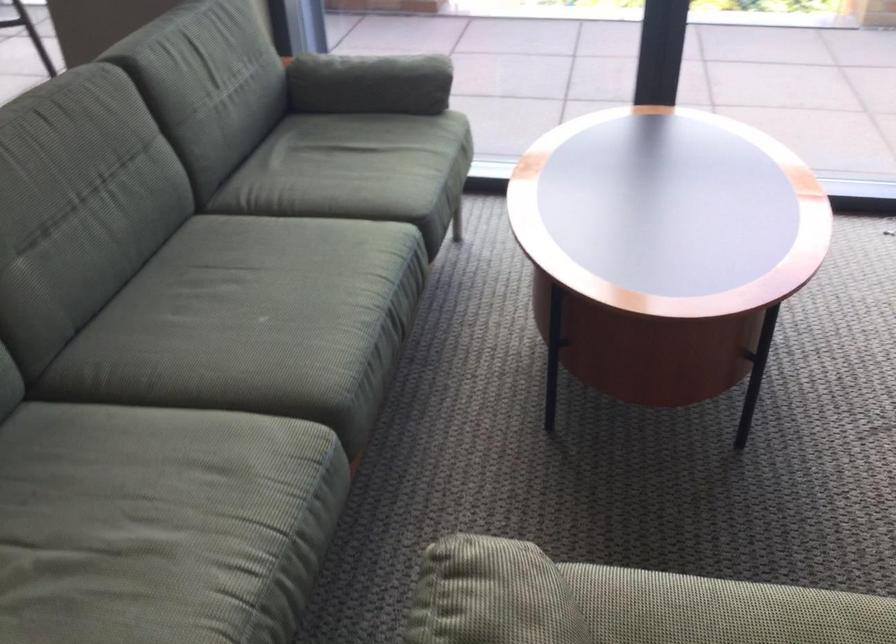
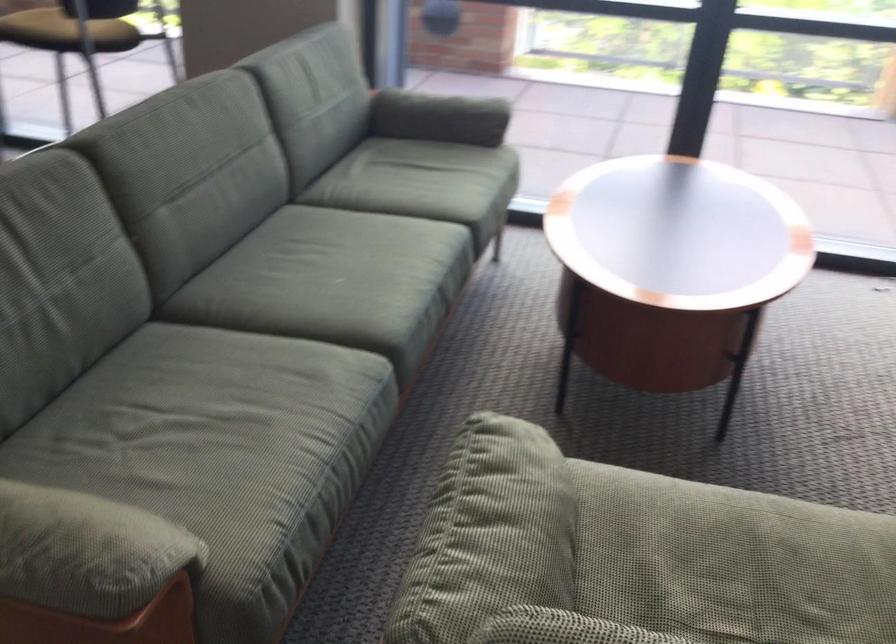
Question: How did the camera likely rotate?

Choices:
 (A) Left
 (B) Right
 (C) Up
 (D) Down

Answer: (C)